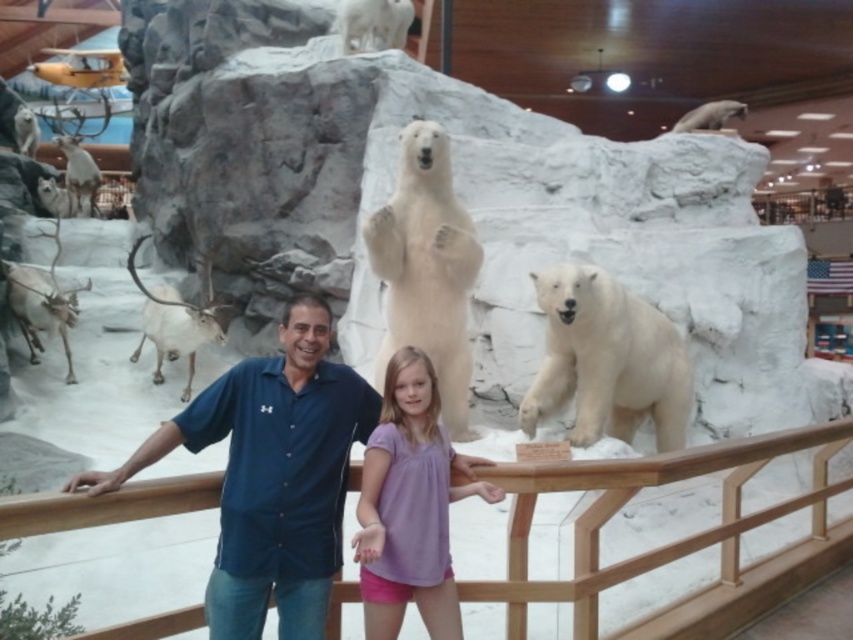
From the picture: Is wooden at center further to the viewer compared to white fur polar bear at center?

No, it is not.

Is point (793, 436) farther from camera compared to point (403, 148)?

No, it is not.

Is point (625, 492) positioned before point (432, 272)?

Yes, point (625, 492) is closer to viewer.

The height and width of the screenshot is (640, 853). What are the coordinates of `wooden at center` in the screenshot? It's located at (630, 499).

Which is in front, point (219, 616) or point (398, 252)?

Point (219, 616) is more forward.

In the scene shown: Who is positioned more to the left, blue cotton shirt at center or white fur polar bear at center?

blue cotton shirt at center is more to the left.

Measure the distance between point (368, 428) and camera.

They are 4.89 meters apart.

The width and height of the screenshot is (853, 640). In order to click on blue cotton shirt at center in this screenshot , I will do `click(271, 476)`.

Which is more to the left, wooden at center or white fur polar bear at right?

wooden at center is more to the left.

Does point (728, 531) come behind point (554, 321)?

That is False.

Does point (641, 564) come closer to viewer compared to point (636, 340)?

Yes, it is in front of point (636, 340).

Identify the location of wooden at center. The image size is (853, 640). (630, 499).